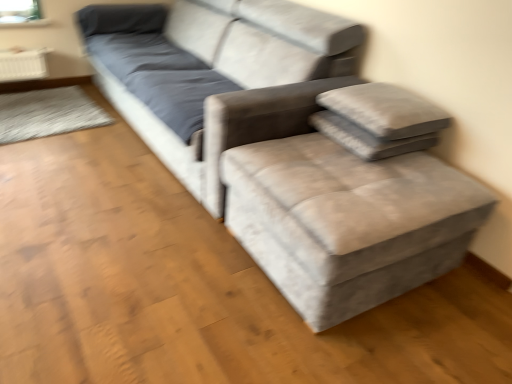
Question: Is point (382, 145) closer or farther from the camera than point (208, 104)?

Choices:
 (A) closer
 (B) farther

Answer: (A)

Question: From a real-world perspective, relative to velvet grey couch at center, is gray fabric pillow at upper right, which appears as the first pillow when ordered from the bottom, vertically above or below?

Choices:
 (A) below
 (B) above

Answer: (B)

Question: Estimate the real-world distances between objects in this image. Which object is closer to the textured gray couch at center?

Choices:
 (A) textured gray pillow at upper right, which ranks as the first pillow in top-to-bottom order
 (B) gray fabric pillow at upper right, which is counted as the 2th pillow, starting from the top
 (C) velvet grey couch at center

Answer: (C)

Question: Which of these objects is positioned closest to the velvet grey couch at center?

Choices:
 (A) textured gray pillow at upper right, the second pillow positioned from the bottom
 (B) gray fabric pillow at upper right, which appears as the first pillow when ordered from the bottom
 (C) textured gray couch at center

Answer: (C)